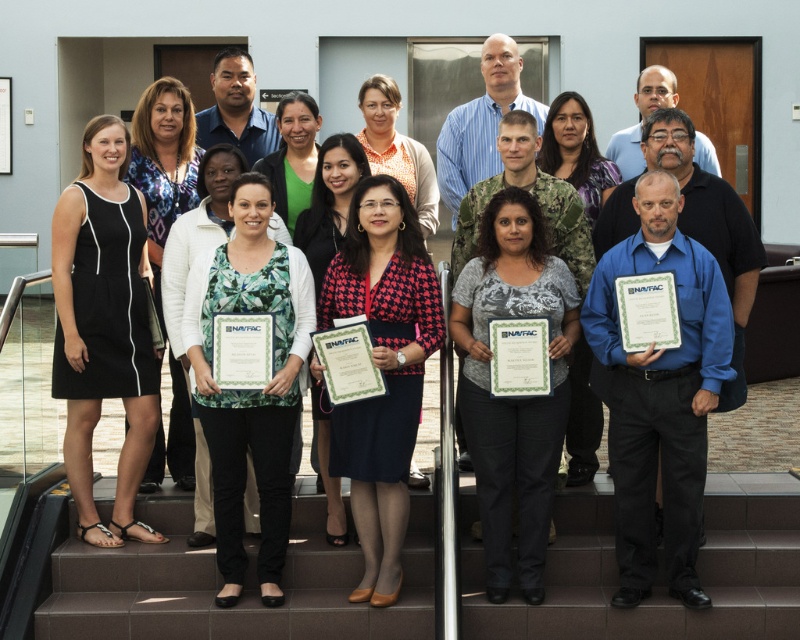
Question: Considering the relative positions of brown tile stairs at lower center and blue cotton shirt at center in the image provided, where is brown tile stairs at lower center located with respect to blue cotton shirt at center?

Choices:
 (A) above
 (B) below

Answer: (B)

Question: Is brown tile stairs at lower center to the right of blue cotton shirt at center from the viewer's perspective?

Choices:
 (A) yes
 (B) no

Answer: (B)

Question: Considering the real-world distances, which object is closest to the gray matte shirt at center?

Choices:
 (A) blue cotton shirt at center
 (B) houndstooth fabric blazer at center
 (C) black sleeveless dress at left

Answer: (B)

Question: Which object is positioned farthest from the black sleeveless dress at left?

Choices:
 (A) brown tile stairs at lower center
 (B) gray matte shirt at center
 (C) blue cotton shirt at center
 (D) houndstooth fabric blazer at center

Answer: (C)

Question: Which of the following is the farthest from the observer?

Choices:
 (A) blue cotton shirt at center
 (B) black sleeveless dress at left

Answer: (B)

Question: Is blue cotton shirt at center positioned before black sleeveless dress at left?

Choices:
 (A) yes
 (B) no

Answer: (A)